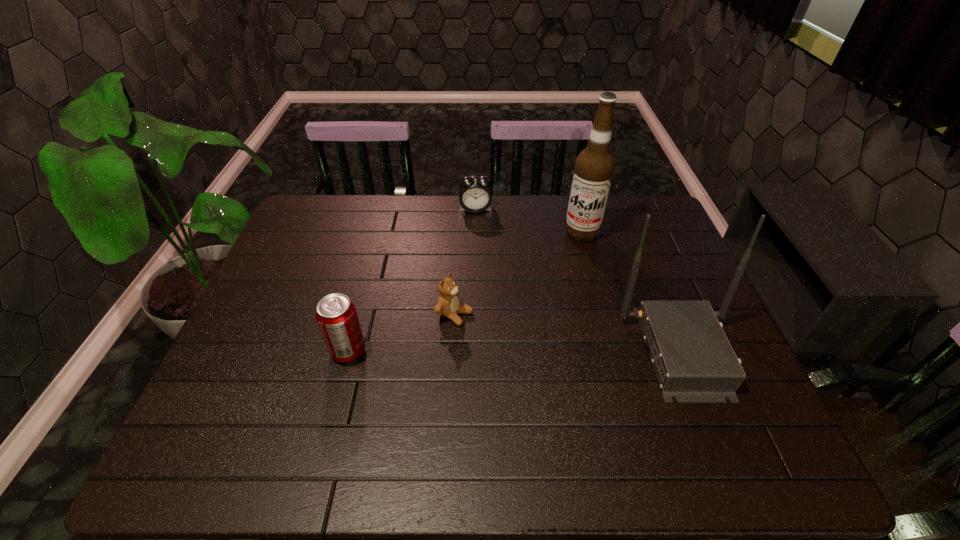
This screenshot has height=540, width=960. In order to click on the third shortest object in this screenshot , I will do `click(336, 315)`.

Where is `soda`? soda is located at coordinates (336, 315).

The width and height of the screenshot is (960, 540). What are the coordinates of `the fourth shortest object` in the screenshot? It's located at (693, 360).

You are a GUI agent. You are given a task and a screenshot of the screen. Output one action in this format:
    pyautogui.click(x=<x>, y=<y>)
    Task: Click on the alcohol
    
    Given the screenshot: What is the action you would take?
    pyautogui.click(x=594, y=167)

Identify the location of the second farthest object. (594, 167).

Where is `alarm clock`? The height and width of the screenshot is (540, 960). alarm clock is located at coordinates (475, 196).

The image size is (960, 540). I want to click on teddy bear, so click(448, 304).

Image resolution: width=960 pixels, height=540 pixels. What are the coordinates of `free spot located on the back of the soda` in the screenshot? It's located at (370, 272).

Locate an element on the screen. The height and width of the screenshot is (540, 960). free spot located 0.320m on the label of the tallest object is located at coordinates (555, 315).

Locate an element on the screen. Image resolution: width=960 pixels, height=540 pixels. vacant space situated on the label of the tallest object is located at coordinates (561, 300).